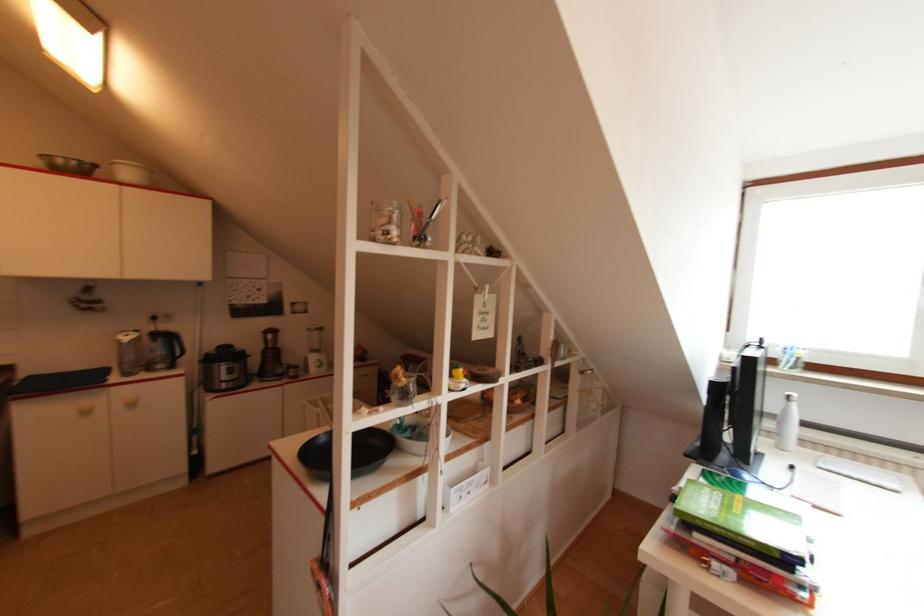
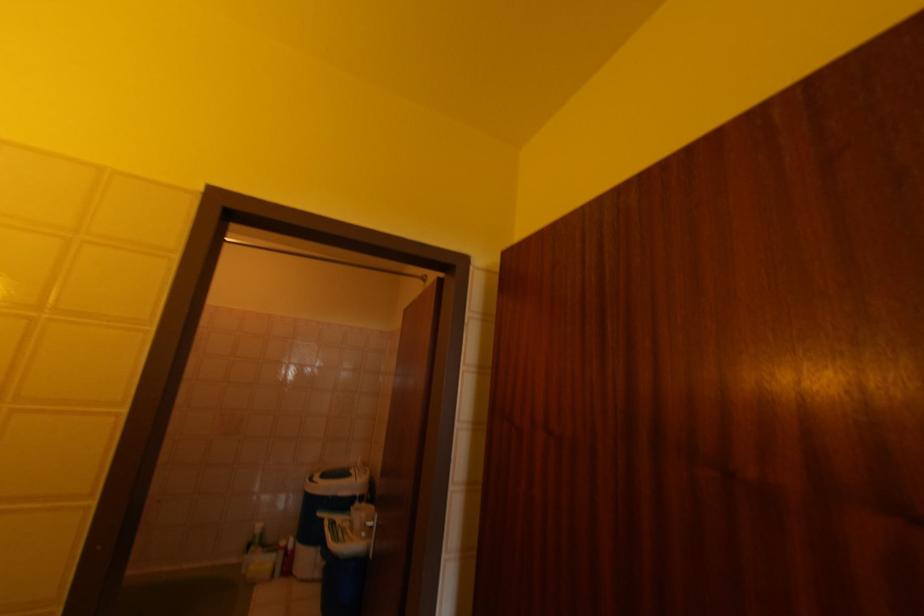
Which direction would the cameraman need to move to produce the second image?

The cameraman moved toward left, backward.